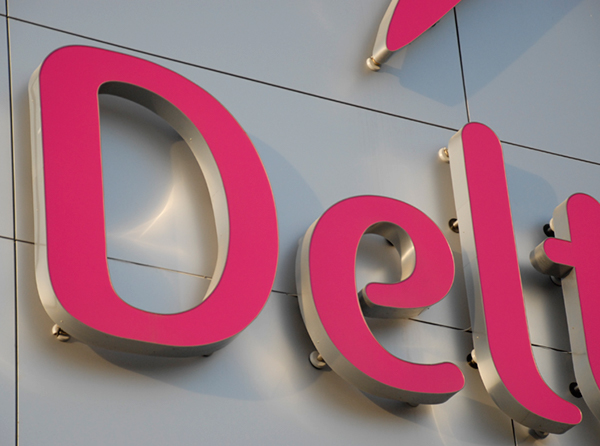
Find the location of a particular element. This screenshot has height=446, width=600. rod is located at coordinates (452, 225), (387, 241), (320, 360).